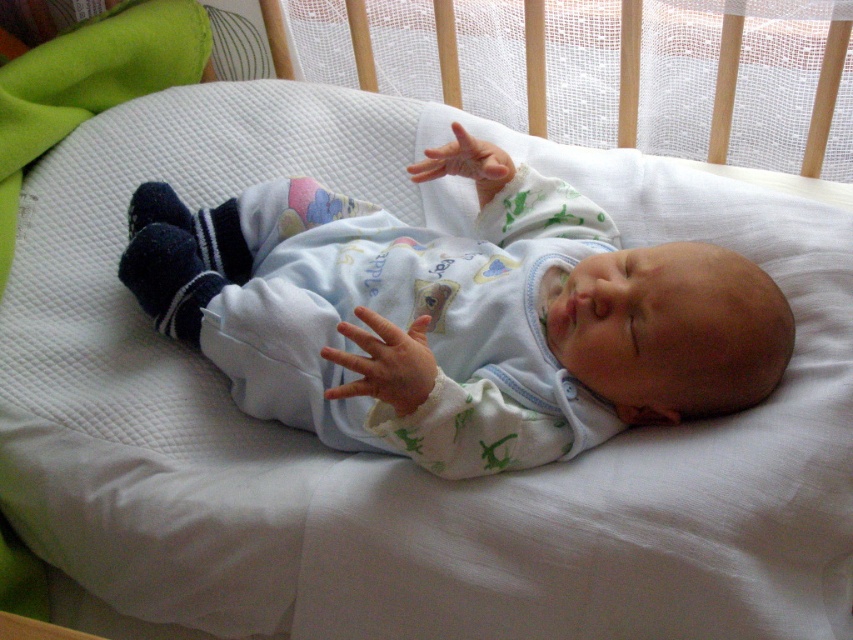
Question: Which object is closer to the camera taking this photo?

Choices:
 (A) white soft fabric hand at center
 (B) white soft hand at center

Answer: (A)

Question: Is white soft baby at center positioned before white soft fabric hand at center?

Choices:
 (A) no
 (B) yes

Answer: (A)

Question: Does white soft fabric hand at center have a lesser width compared to white soft hand at center?

Choices:
 (A) yes
 (B) no

Answer: (A)

Question: Which point appears farthest from the camera in this image?

Choices:
 (A) (172, 280)
 (B) (491, 186)

Answer: (B)

Question: Which is nearer to the white soft hand at center?

Choices:
 (A) white soft baby at center
 (B) white soft fabric hand at center

Answer: (A)

Question: Is white soft baby at center to the right of white soft hand at center from the viewer's perspective?

Choices:
 (A) no
 (B) yes

Answer: (A)